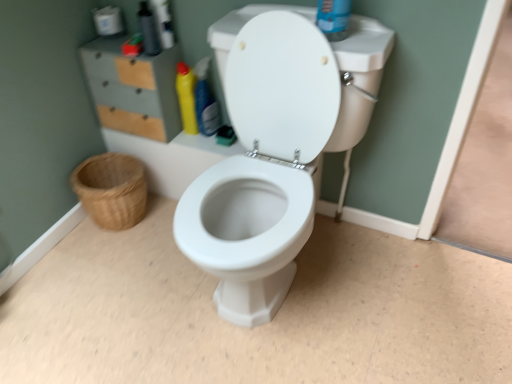
Question: Considering the positions of point (121, 119) and point (100, 14), is point (121, 119) closer or farther from the camera than point (100, 14)?

Choices:
 (A) farther
 (B) closer

Answer: (A)

Question: Considering the relative positions of matte gray/file cabinet at upper left and white matte toilet paper at upper left in the image provided, is matte gray/file cabinet at upper left to the left or to the right of white matte toilet paper at upper left?

Choices:
 (A) right
 (B) left

Answer: (A)

Question: Which object is positioned farthest from the woven natural basket at lower left?

Choices:
 (A) translucent plastic bottle at upper left
 (B) white matte toilet paper at upper left
 (C) matte gray/file cabinet at upper left
 (D) yellow plastic bottle at upper left, the 1th cleaning product viewed from the left
 (E) yellow glossy bottle at center, positioned as the 1th cleaning product in right-to-left order

Answer: (B)

Question: Estimate the real-world distances between objects in this image. Which object is closer to the matte gray/file cabinet at upper left?

Choices:
 (A) yellow plastic bottle at upper left, the 1th cleaning product viewed from the left
 (B) yellow glossy bottle at center, which is the 2th cleaning product in left-to-right order
 (C) white matte toilet paper at upper left
 (D) translucent plastic bottle at upper left
 (E) woven natural basket at lower left

Answer: (A)